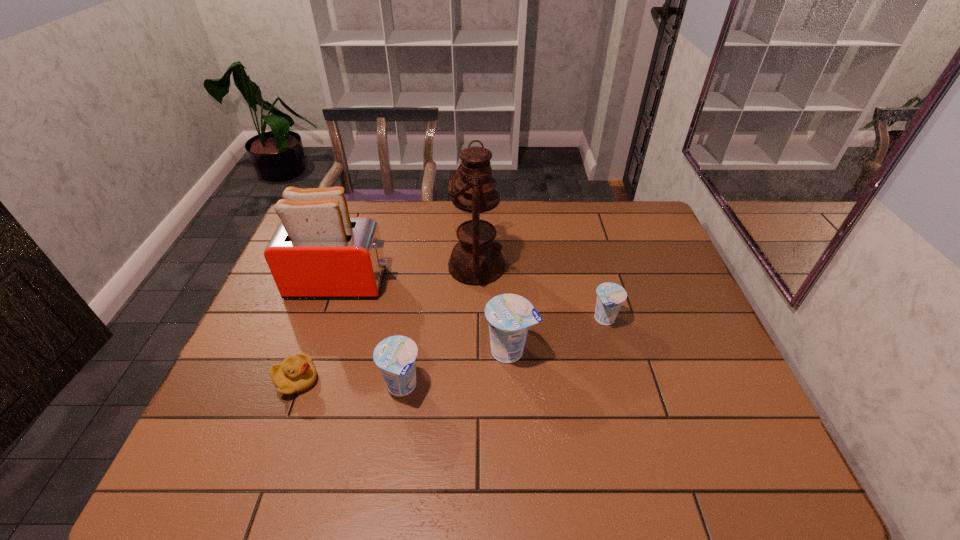
Where is `free spot that satisfies the following two spatial constraints: 1. on the back side of the tallest yogurt; 2. on the front-facing side of the fifth shortest object`? Image resolution: width=960 pixels, height=540 pixels. free spot that satisfies the following two spatial constraints: 1. on the back side of the tallest yogurt; 2. on the front-facing side of the fifth shortest object is located at coordinates (506, 283).

Find the location of a particular element. free spot that satisfies the following two spatial constraints: 1. on the back side of the third object from left to right; 2. on the front-facing side of the second tallest object is located at coordinates (418, 283).